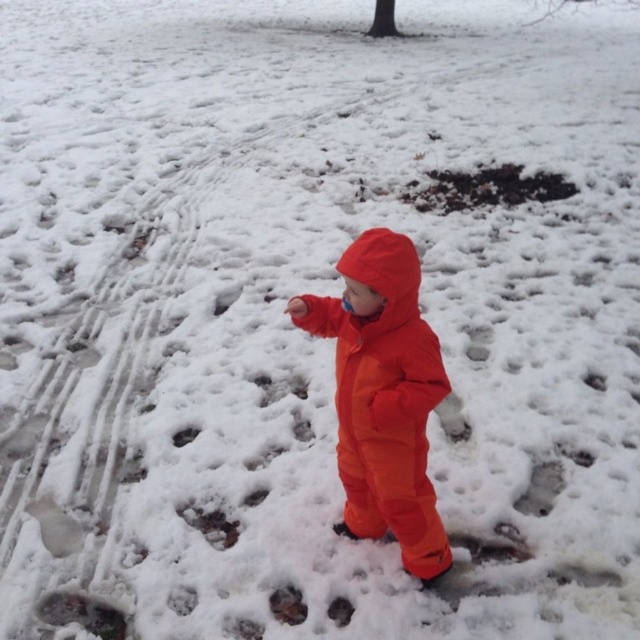
Is orange waterproof snowsuit at center wider than brown dirt at center?

No.

Can you confirm if orange waterproof snowsuit at center is positioned below brown dirt at center?

Yes, orange waterproof snowsuit at center is below brown dirt at center.

Does point (346, 387) come farther from viewer compared to point (500, 164)?

No, it is in front of (500, 164).

I want to click on orange waterproof snowsuit at center, so click(384, 396).